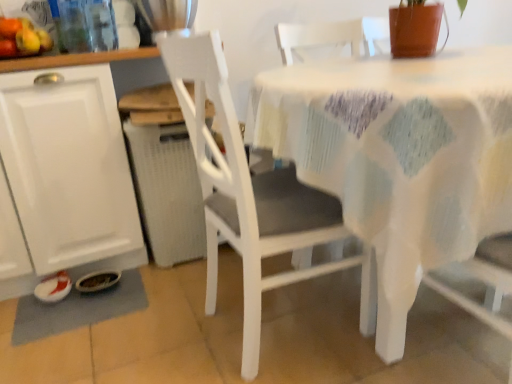
Question: Is white fabric-covered table at center wider or thinner than gray fabric place mat at lower left?

Choices:
 (A) thin
 (B) wide

Answer: (B)

Question: From the image's perspective, is white fabric-covered table at center positioned above or below gray fabric place mat at lower left?

Choices:
 (A) below
 (B) above

Answer: (B)

Question: Considering the real-world distances, which object is closest to the white fabric-covered table at center?

Choices:
 (A) white matte cabinet at left
 (B) white matte chair at center
 (C) gray fabric place mat at lower left
 (D) shiny plastic fruits at upper left

Answer: (B)

Question: Which object is the closest to the white matte cabinet at left?

Choices:
 (A) gray fabric place mat at lower left
 (B) white matte chair at center
 (C) white fabric-covered table at center
 (D) shiny plastic fruits at upper left

Answer: (A)